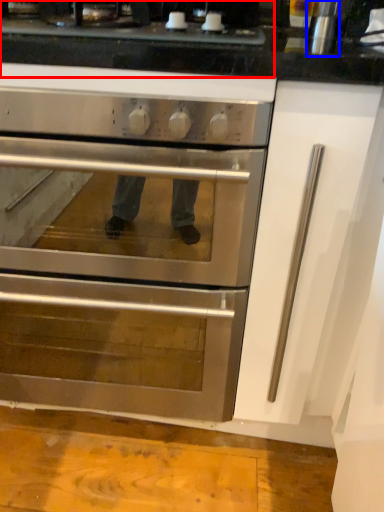
Question: Which object appears farthest to the camera in this image, gas stove (highlighted by a red box) or appliance (highlighted by a blue box)?

Choices:
 (A) gas stove
 (B) appliance

Answer: (B)